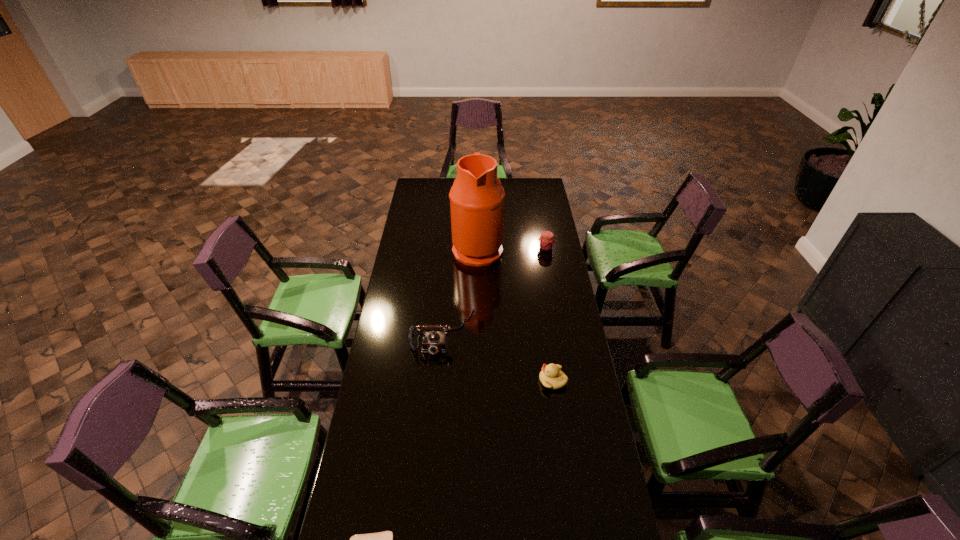
This screenshot has height=540, width=960. I want to click on the tallest object, so (477, 197).

Where is `telephone`? telephone is located at coordinates (433, 342).

Find the location of a particular element. Image resolution: width=960 pixels, height=540 pixels. the third nearest object is located at coordinates (433, 342).

Locate an element on the screen. This screenshot has height=540, width=960. jam is located at coordinates (546, 241).

This screenshot has width=960, height=540. Identify the location of duckling. (551, 376).

At what (x,y) coordinates should I click in order to perform the action: click on vacant space situated from the spout of the water jug. Please return your answer as a coordinate pair (x, y). Looking at the image, I should click on (553, 248).

The width and height of the screenshot is (960, 540). What are the coordinates of `blank space located on the dial of the second tallest object` in the screenshot? It's located at (438, 396).

Find the location of `free spot located on the front of the jam`. free spot located on the front of the jam is located at coordinates (557, 308).

You are a GUI agent. You are given a task and a screenshot of the screen. Output one action in this format:
    pyautogui.click(x=<x>, y=<y>)
    Task: Click on the free space located 0.390m on the beak of the fourth farthest object
    
    Given the screenshot: What is the action you would take?
    pyautogui.click(x=440, y=381)

Find the location of a particular element. The height and width of the screenshot is (540, 960). blank space located on the beak of the fourth farthest object is located at coordinates (438, 381).